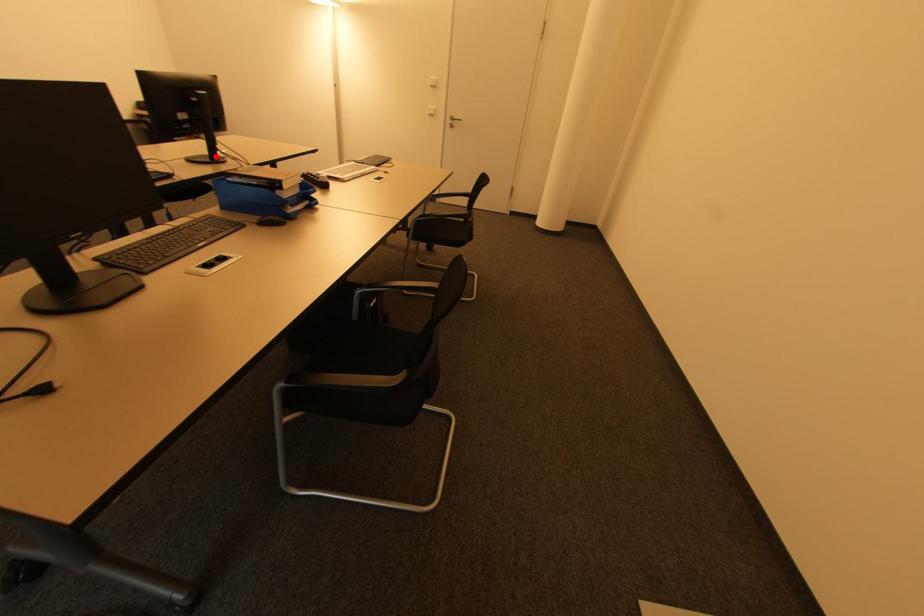
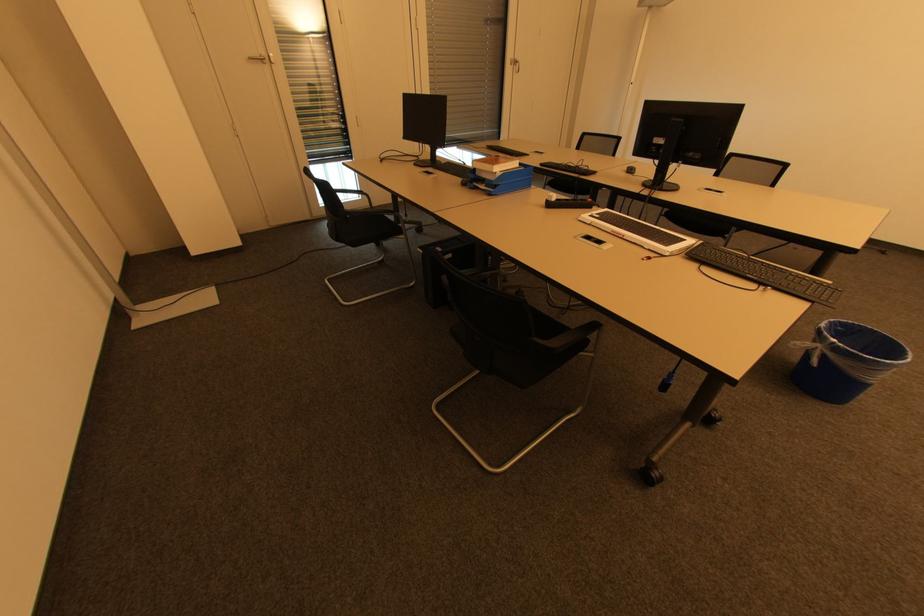
Where in the second image is the point corresponding to the highlighted location from the first image?

(660, 183)